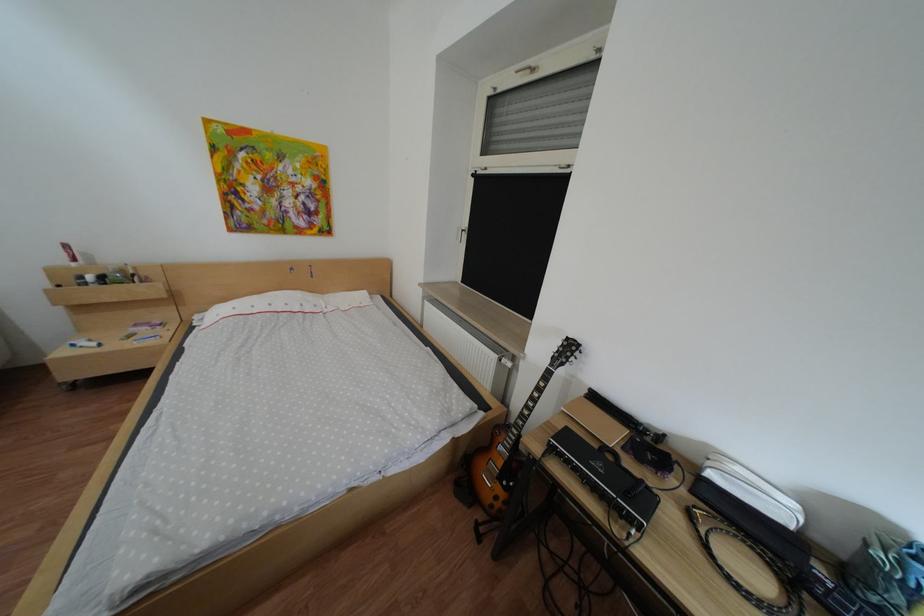
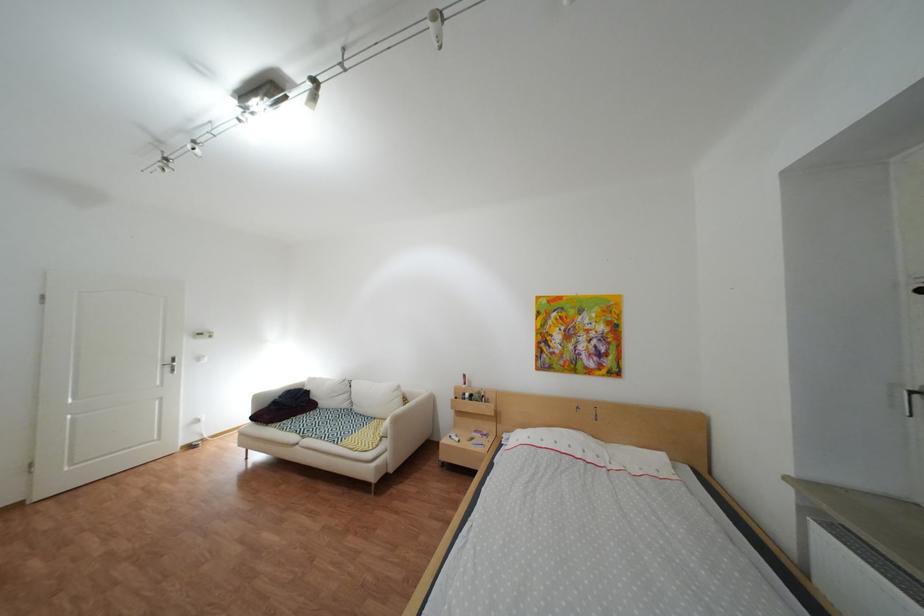
The point at (98, 278) is marked in the first image. Where is the corresponding point in the second image?

(480, 395)